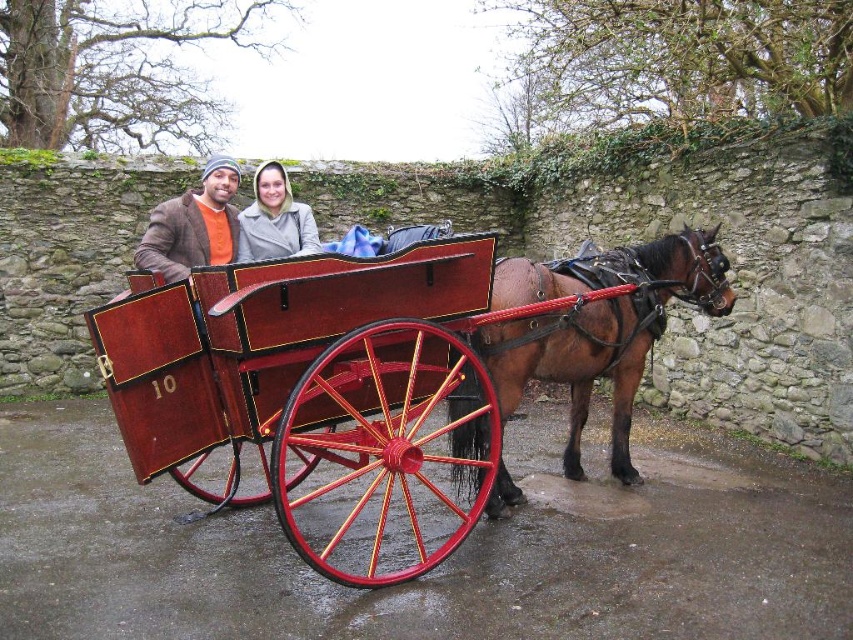
You are a guest in the carriage and want to compare the height of the shiny wood cart at center and the brown glossy horse at center. Which one is taller?

The brown glossy horse at center is taller than the shiny wood cart at center.